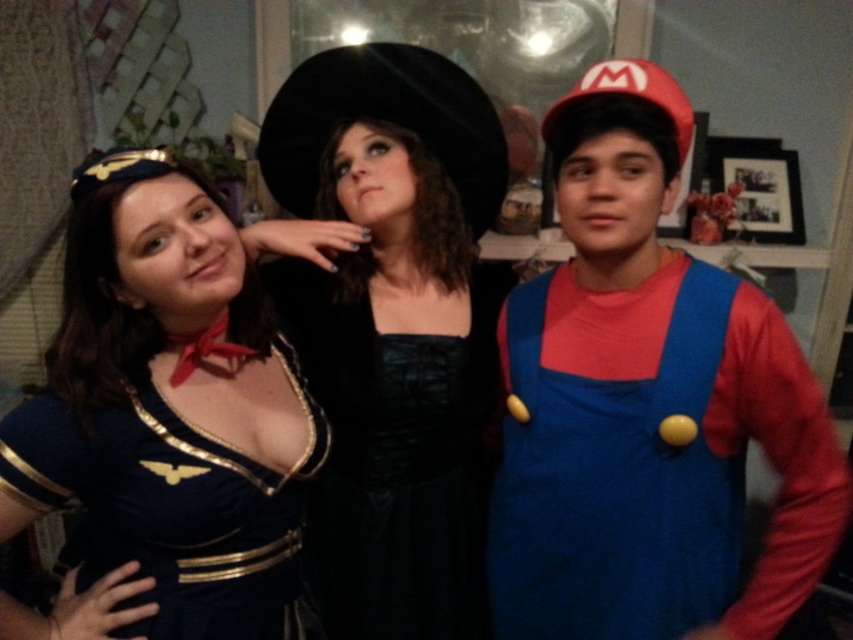
You are a photographer setting up a photo shoot for a fashion magazine. You have two dresses at the center of your setup, a velvet black dress at center and a black satin dress at center. The camera you are using has a depth of field that can focus on objects within a 3 inch range. Can both dresses be in focus at the same time?

The velvet black dress at center is 3.19 inches away from the black satin dress at center. Since the distance between them is slightly more than 3 inches, they cannot both be in focus simultaneously with the camera settings provided.

In the scene shown: You are standing in the room and see the velvet black dress at center. Can you estimate its location relative to the window?

The velvet black dress at center is located at point 0.505 on the horizontal axis and 0.453 on the vertical axis. Since the window is part of the background, it is likely positioned behind the dress, but without specific coordinates for the window, an exact comparison cannot be made.

You are a photographer trying to capture a group photo of the three individuals. You notice two black dresses at the center. Which one is more to the left between the velvet black dress at center and the black satin dress at center?

The velvet black dress at center is positioned on the left side of the black satin dress at center, so the velvet black dress at center is more to the left.